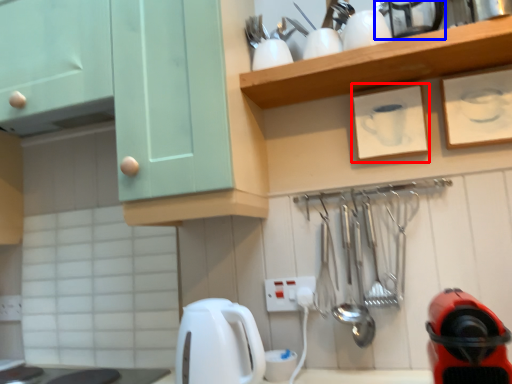
Question: Which object appears farthest to the camera in this image, picture frame (highlighted by a red box) or appliance (highlighted by a blue box)?

Choices:
 (A) picture frame
 (B) appliance

Answer: (A)